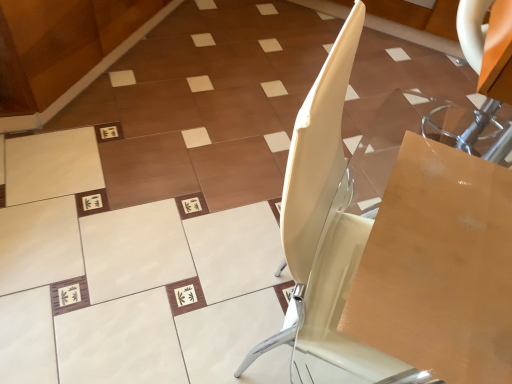
You are a GUI agent. You are given a task and a screenshot of the screen. Output one action in this format:
    pyautogui.click(x=<x>, y=<y>)
    Task: Click on the free point above wooden cardboard box at center-right (from a real-world perspective)
    
    Given the screenshot: What is the action you would take?
    pyautogui.click(x=457, y=243)